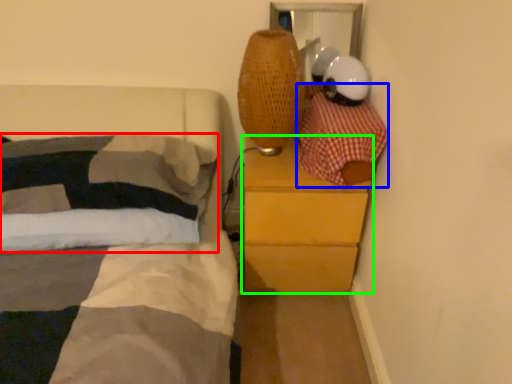
Question: Which is nearer to the pillow (highlighted by a red box)? blanket (highlighted by a blue box) or chest of drawers (highlighted by a green box).

Choices:
 (A) blanket
 (B) chest of drawers

Answer: (B)